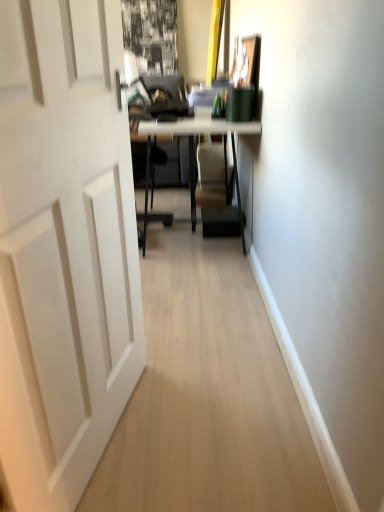
The image size is (384, 512). Find the location of `vacant space behind white matte door at left`. vacant space behind white matte door at left is located at coordinates (185, 346).